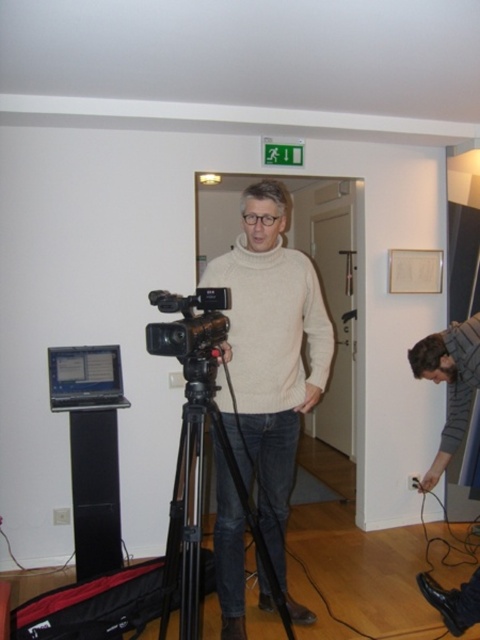
Question: Is light beige sweater at center closer to the viewer compared to black plastic camera at center?

Choices:
 (A) yes
 (B) no

Answer: (B)

Question: Does light beige sweater at center come behind black plastic camera at center?

Choices:
 (A) no
 (B) yes

Answer: (B)

Question: Does light beige sweater at center have a smaller size compared to black matte tripod at center?

Choices:
 (A) no
 (B) yes

Answer: (A)

Question: Which point is farther to the camera?

Choices:
 (A) (179, 525)
 (B) (223, 294)
 (C) (439, 364)

Answer: (C)

Question: Considering the real-world distances, which object is farthest from the striped sweater at lower right?

Choices:
 (A) light beige sweater at center
 (B) black matte tripod at center

Answer: (B)

Question: Estimate the real-world distances between objects in this image. Which object is farther from the black matte tripod at center?

Choices:
 (A) black plastic camera at center
 (B) light beige sweater at center
 (C) striped sweater at lower right

Answer: (C)